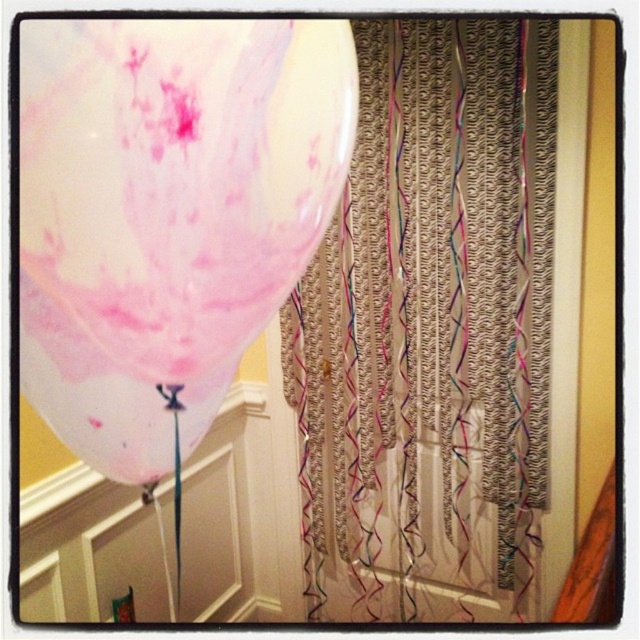
Question: Is textured beige curtain at center to the left of translucent pink balloon at upper left from the viewer's perspective?

Choices:
 (A) yes
 (B) no

Answer: (B)

Question: Can you confirm if textured beige curtain at center is positioned below translucent pink balloon at upper left?

Choices:
 (A) no
 (B) yes

Answer: (B)

Question: Does textured beige curtain at center have a greater width compared to translucent pink balloon at upper left?

Choices:
 (A) yes
 (B) no

Answer: (A)

Question: Which of the following is the closest to the observer?

Choices:
 (A) translucent pink balloon at upper left
 (B) textured beige curtain at center

Answer: (A)

Question: Which object is farther from the camera taking this photo?

Choices:
 (A) textured beige curtain at center
 (B) translucent pink balloon at upper left

Answer: (A)